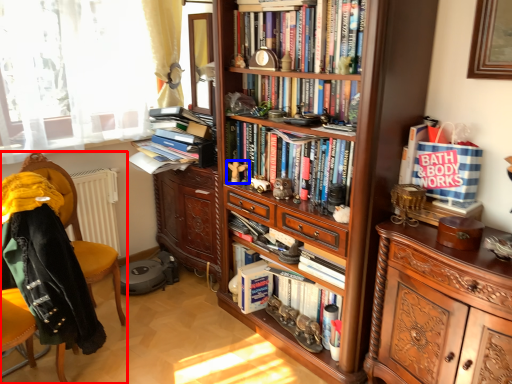
Question: Among these objects, which one is farthest to the camera, chair (highlighted by a red box) or toy (highlighted by a blue box)?

Choices:
 (A) chair
 (B) toy

Answer: (B)